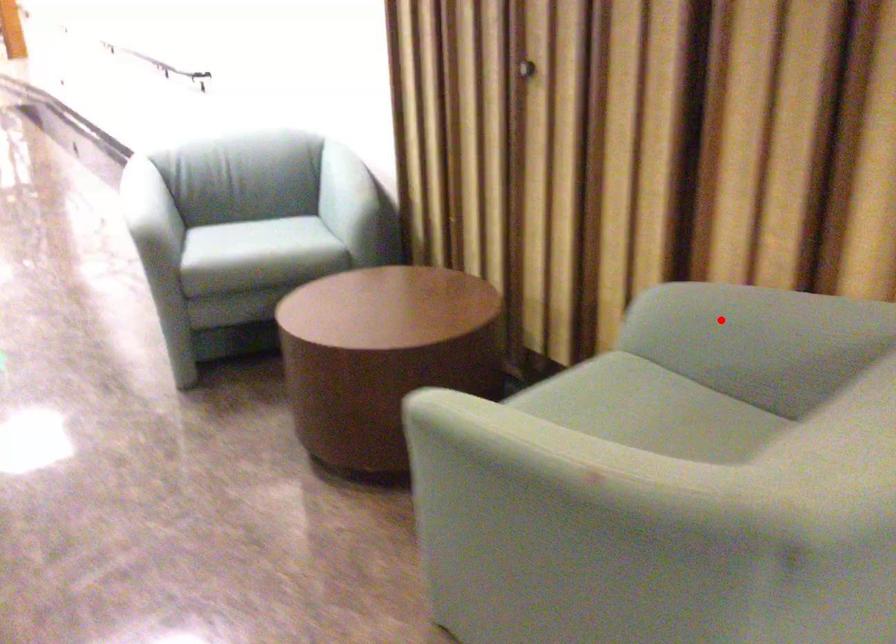
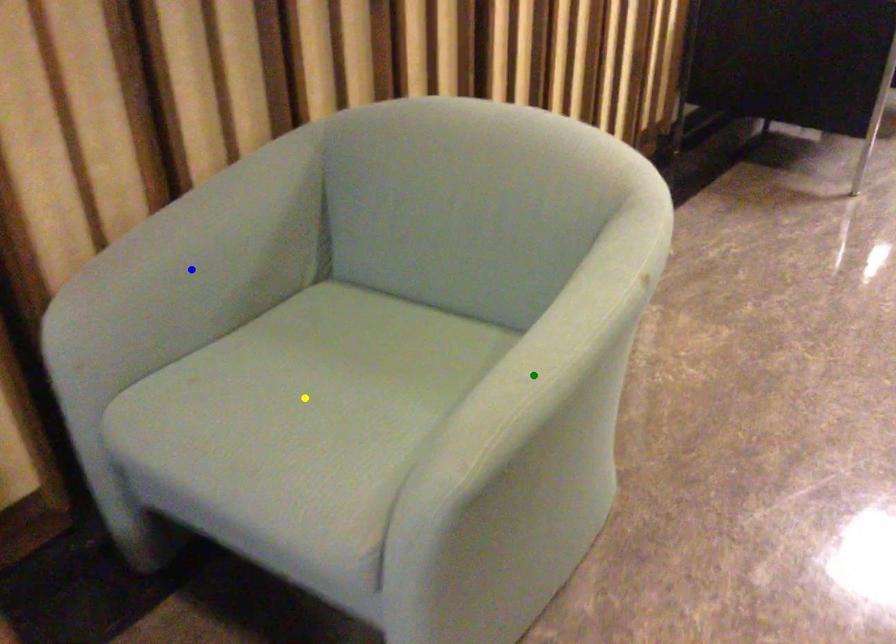
Question: I am providing you with two images of the same scene from different viewpoints. A red point is marked on the first image. You are given multiple points on the second image. Which spot in image 2 lines up with the point in image 1?

Choices:
 (A) green point
 (B) yellow point
 (C) blue point

Answer: (C)